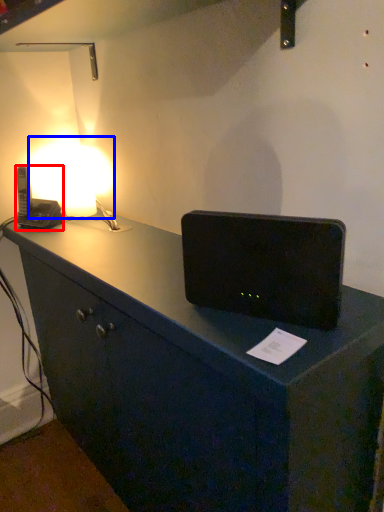
Question: Which object is closer to the camera taking this photo, gadget (highlighted by a red box) or lamp (highlighted by a blue box)?

Choices:
 (A) gadget
 (B) lamp

Answer: (A)